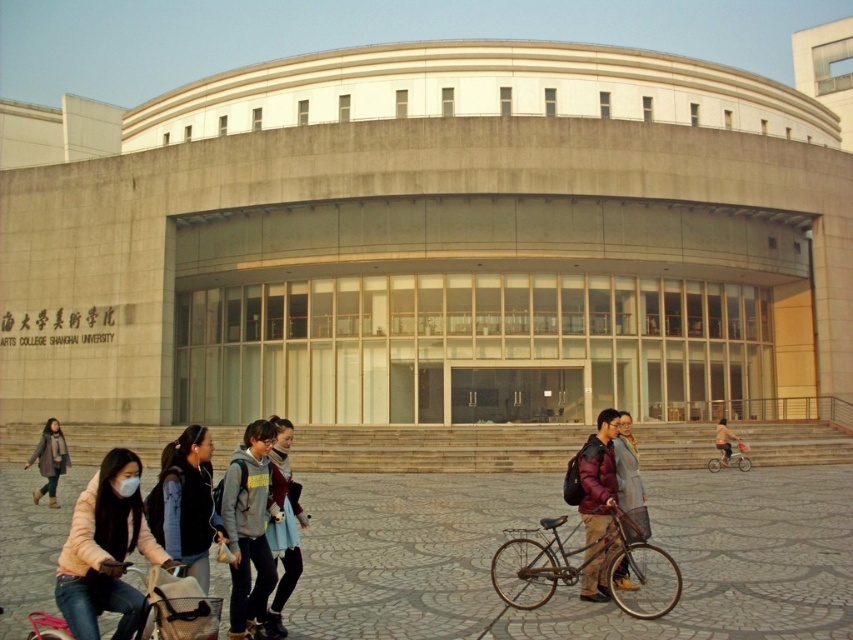
You are standing at the entrance of the university building and want to walk towards the point marked at coordinates point (595, 465). If there is an obstacle located at point (630, 451), would you need to detour around it?

Point (595, 465) is in front of point (630, 451), so you would not need to detour around the obstacle at point (630, 451) because your path is clear.

You are a visitor arriving at the university building and want to find the entrance. You see a rusty metal bicycle at lower center and a light blue fabric coat at center. Based on their positions, which object is closer to the entrance steps?

The rusty metal bicycle at lower center is closer to the entrance steps because it is located below the light blue fabric coat at center, indicating it is positioned lower in the scene and likely nearer to the base of the building where the entrance steps are located.